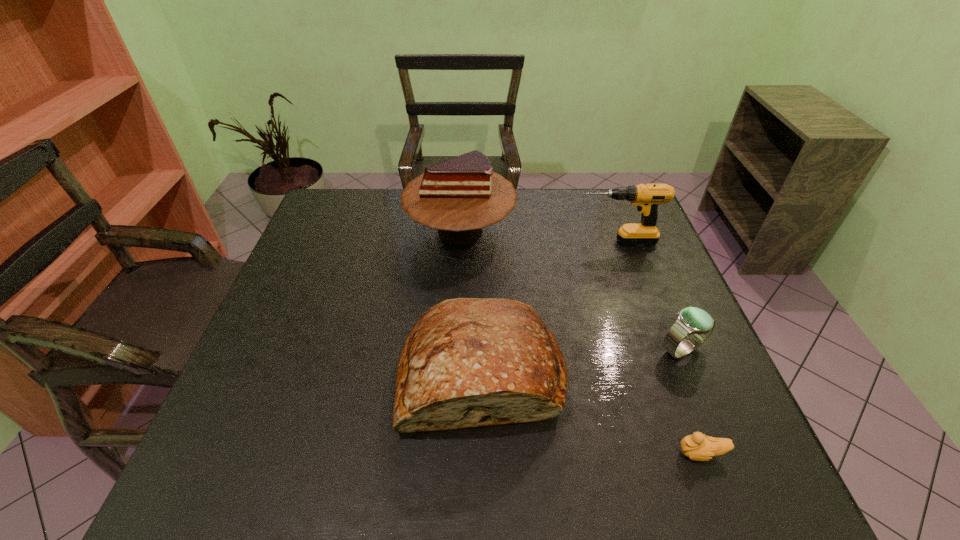
At what (x,y) coordinates should I click in order to perform the action: click on vacant region located at the sliced front of the bread. Please return your answer as a coordinate pair (x, y). Looking at the image, I should click on (482, 483).

Where is `vacant space located 0.170m on the front of the fourth tallest object`? The height and width of the screenshot is (540, 960). vacant space located 0.170m on the front of the fourth tallest object is located at coordinates (717, 437).

You are a GUI agent. You are given a task and a screenshot of the screen. Output one action in this format:
    pyautogui.click(x=<x>, y=<y>)
    Task: Click on the vacant space located 0.070m on the face of the shortest object
    The image size is (960, 540).
    Given the screenshot: What is the action you would take?
    pyautogui.click(x=639, y=454)

Where is `vacant region located 0.060m on the face of the shortest object`? This screenshot has width=960, height=540. vacant region located 0.060m on the face of the shortest object is located at coordinates (645, 454).

Identify the location of free location located on the face of the shortest object. This screenshot has height=540, width=960. (624, 454).

Locate an element on the screen. The image size is (960, 540). object that is at the far edge is located at coordinates (460, 196).

Locate an element on the screen. This screenshot has width=960, height=540. object that is positioned at the near edge is located at coordinates (697, 447).

The image size is (960, 540). What are the coordinates of `drill that is at the right edge` in the screenshot? It's located at (647, 197).

Find the location of a particular element. watch present at the right edge is located at coordinates (697, 323).

Where is `duckling positioned at the right edge`? duckling positioned at the right edge is located at coordinates (697, 447).